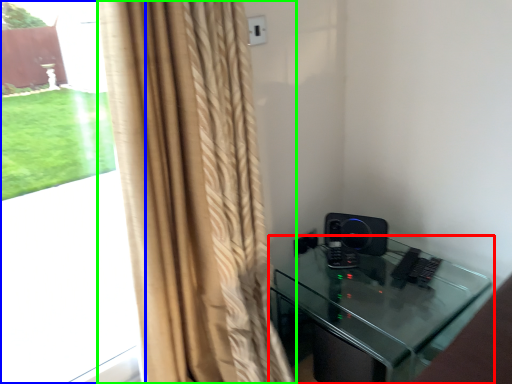
Question: Based on their relative distances, which object is nearer to furniture (highlighted by a red box)? Choose from bay window (highlighted by a blue box) and curtain (highlighted by a green box).

Choices:
 (A) bay window
 (B) curtain

Answer: (B)